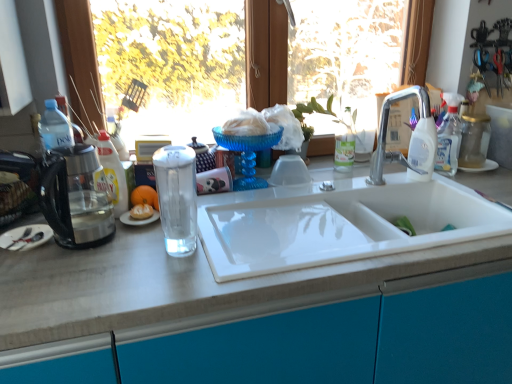
At what (x,y) coordinates should I click in order to perform the action: click on spots to the right of white glossy bottle at upper right. Please return your answer as a coordinate pair (x, y). The width and height of the screenshot is (512, 384). Looking at the image, I should click on pos(445,181).